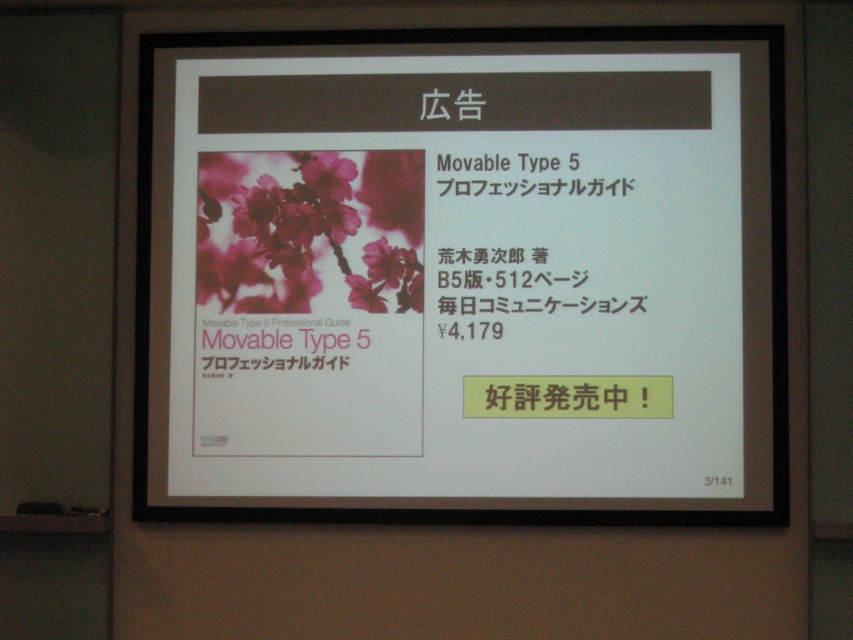
Question: In this image, where is matte paper cover at center located relative to pink matte text at center?

Choices:
 (A) above
 (B) below

Answer: (A)

Question: Is matte paper cover at center positioned in front of pink matte text at center?

Choices:
 (A) no
 (B) yes

Answer: (B)

Question: Among these objects, which one is nearest to the camera?

Choices:
 (A) matte paper cover at center
 (B) pink matte text at center

Answer: (A)

Question: Where is matte paper cover at center located in relation to pink matte text at center in the image?

Choices:
 (A) below
 (B) above

Answer: (B)

Question: Which object appears farthest from the camera in this image?

Choices:
 (A) matte paper cover at center
 (B) pink matte text at center

Answer: (B)